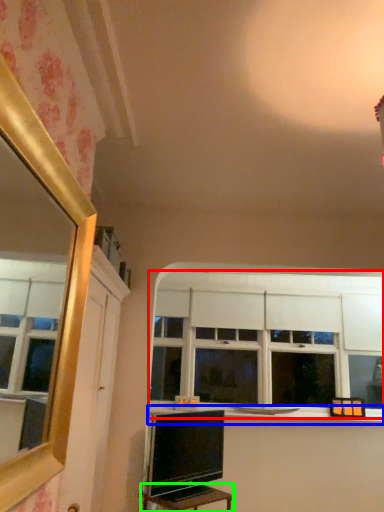
Question: Based on their relative distances, which object is nearer to window (highlighted by a red box)? Choose from window sill (highlighted by a blue box) and table (highlighted by a green box).

Choices:
 (A) window sill
 (B) table

Answer: (A)